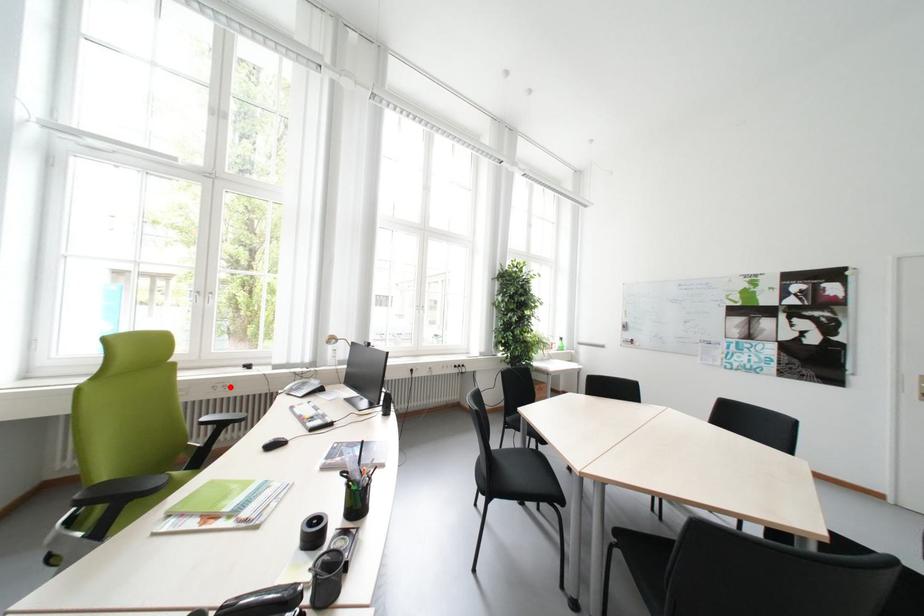
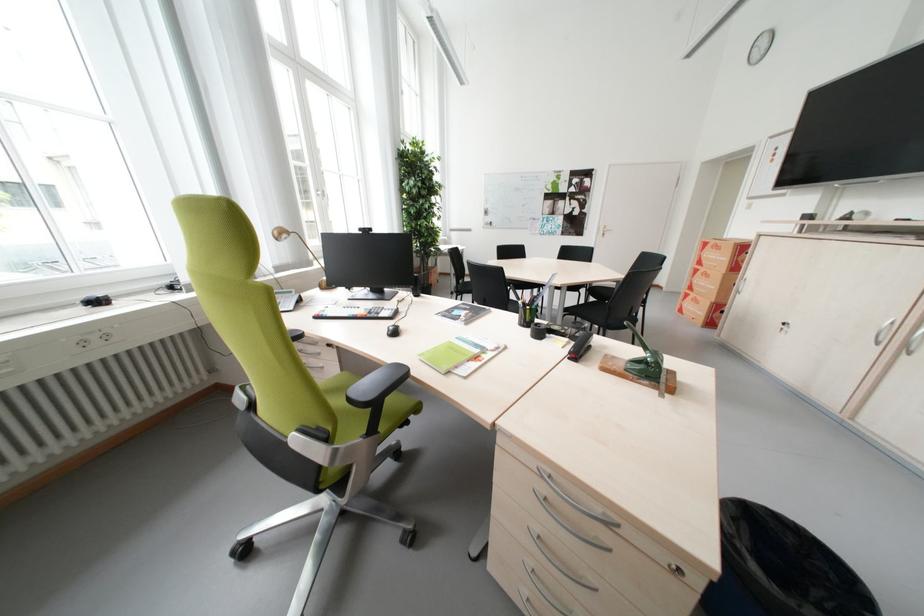
Where in the second image is the point corresponding to the highlighted location from the first image?

(104, 339)